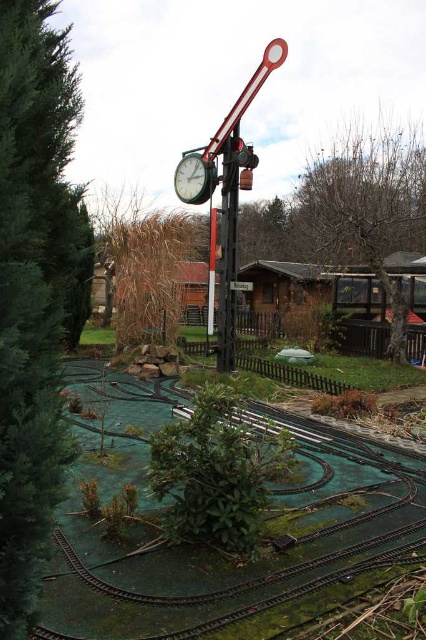
You are a model train enthusiast who wants to place a new train on the green rubber train track at lower center. However, you notice the metallic clock at center might interfere with the train movement. Can the train pass safely without hitting the clock?

The green rubber train track at lower center is shorter than the metallic clock at center, so the train might not have enough space to pass safely and could collide with the clock.

You are a model train enthusiast inspecting the miniature railway setup. You notice the green rubber train track at lower center and the bare branches at right. Which object appears smaller in size?

The green rubber train track at lower center appears smaller in size compared to the bare branches at right.